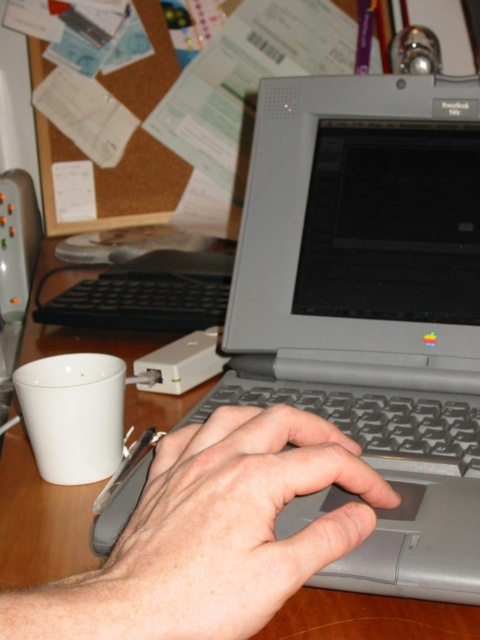
Is gray matte hand at center further to the viewer compared to gray plastic keyboard at center?

That is False.

Who is higher up, gray matte hand at center or gray plastic keyboard at center?

Positioned higher is gray plastic keyboard at center.

Who is more forward, (130, 518) or (396, 406)?

Point (130, 518) is more forward.

Locate an element on the screen. The width and height of the screenshot is (480, 640). gray matte hand at center is located at coordinates (x=232, y=524).

Does gray plastic keyboard at center appear under wooden table at center?

Yes, gray plastic keyboard at center is below wooden table at center.

Which is more to the right, gray plastic keyboard at center or wooden table at center?

From the viewer's perspective, gray plastic keyboard at center appears more on the right side.

Between point (254, 392) and point (62, 556), which one is positioned in front?

Positioned in front is point (62, 556).

At what (x,y) coordinates should I click in order to perform the action: click on gray plastic keyboard at center. Please return your answer as a coordinate pair (x, y). This screenshot has height=640, width=480. Looking at the image, I should click on (372, 420).

Does gray matte hand at center lie in front of wooden table at center?

That is True.

Does gray matte hand at center appear over wooden table at center?

No.

Where is `gray matte hand at center`? Image resolution: width=480 pixels, height=640 pixels. gray matte hand at center is located at coordinates (232, 524).

Locate an element on the screen. The height and width of the screenshot is (640, 480). gray matte hand at center is located at coordinates (232, 524).